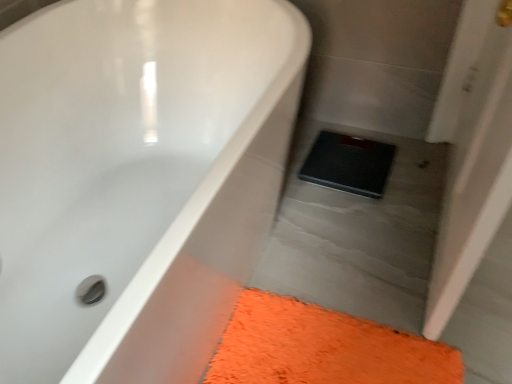
At what (x,y) coordinates should I click in order to perform the action: click on free point behind orange shaggy bath mat at lower right. Please return your answer as a coordinate pair (x, y). Image resolution: width=512 pixels, height=384 pixels. Looking at the image, I should click on (344, 251).